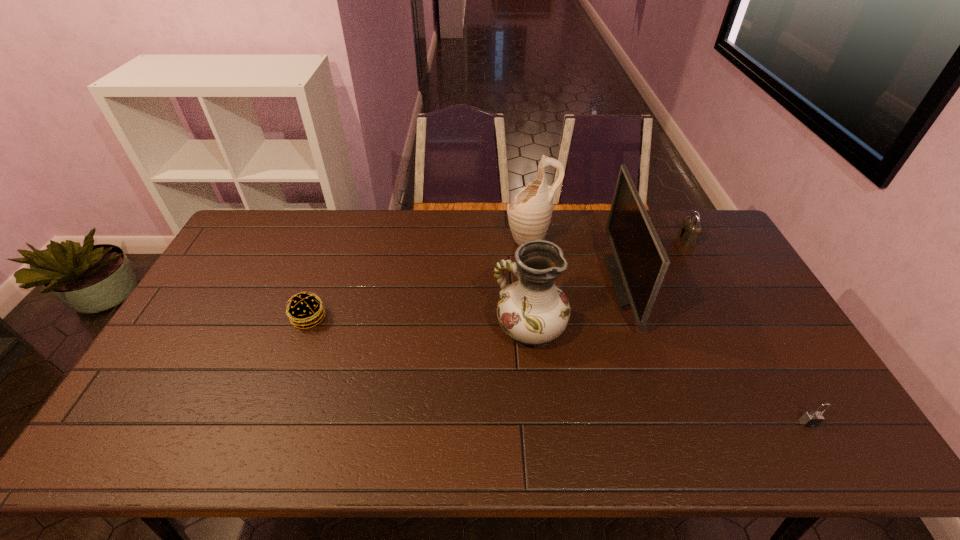
Image resolution: width=960 pixels, height=540 pixels. In order to click on pitcher in this screenshot , I will do `click(529, 215)`.

Locate an element on the screen. The image size is (960, 540). the third object from right to left is located at coordinates (637, 271).

Find the location of a particular element. The height and width of the screenshot is (540, 960). vase is located at coordinates (533, 311).

Where is `the third shortest object`? the third shortest object is located at coordinates (689, 232).

Identify the location of the left padlock. (689, 232).

Find the location of `the nearest object`. the nearest object is located at coordinates (813, 418).

This screenshot has height=540, width=960. I want to click on the shorter padlock, so click(813, 418).

Locate an element on the screen. the leftmost object is located at coordinates (305, 310).

The width and height of the screenshot is (960, 540). I want to click on free space located 0.340m at the spout of the pitcher, so click(x=411, y=240).

Image resolution: width=960 pixels, height=540 pixels. I want to click on vacant region located 0.070m at the spout of the pitcher, so click(x=486, y=240).